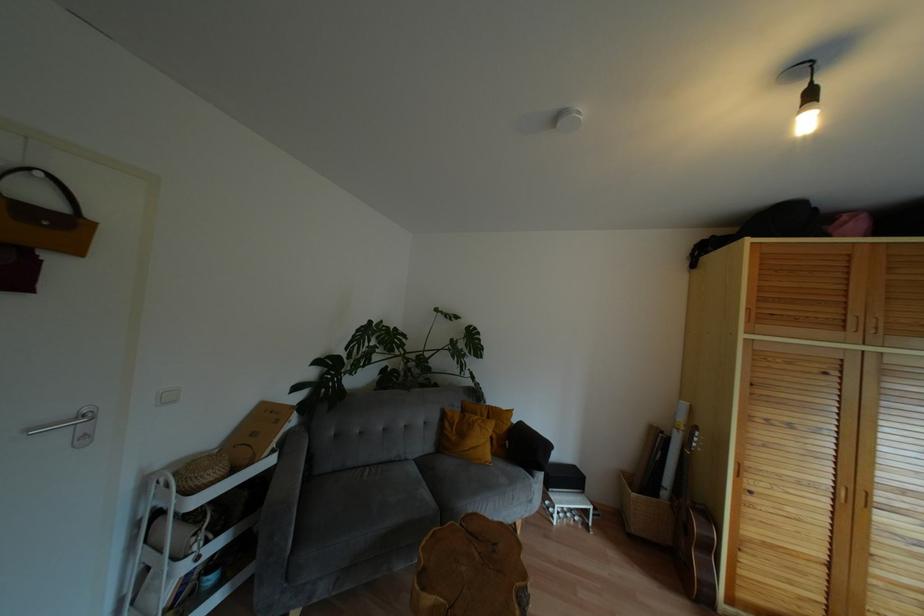
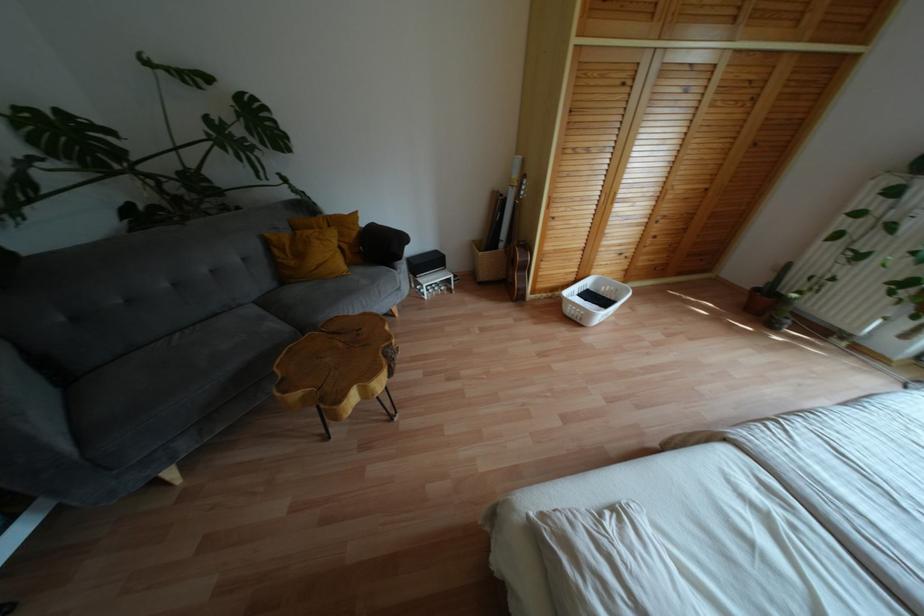
In the second image, find the point that corresponds to [710,548] in the first image.

(525, 267)